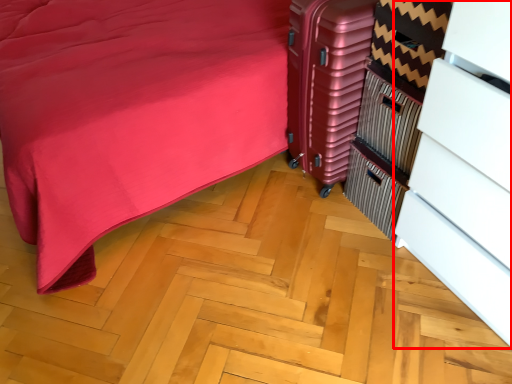
Question: Where is dresser (annotated by the red box) located in relation to luggage in the image?

Choices:
 (A) left
 (B) right

Answer: (B)